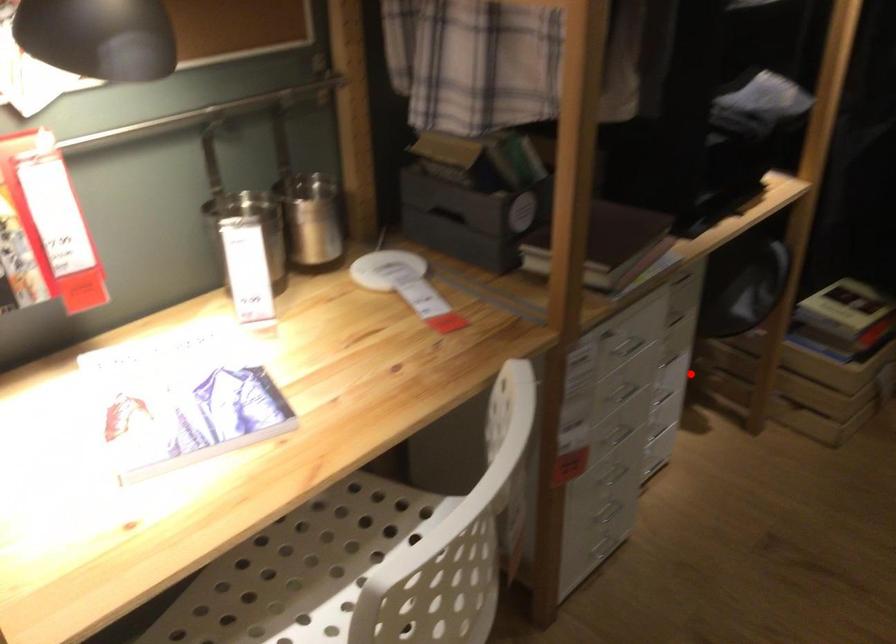
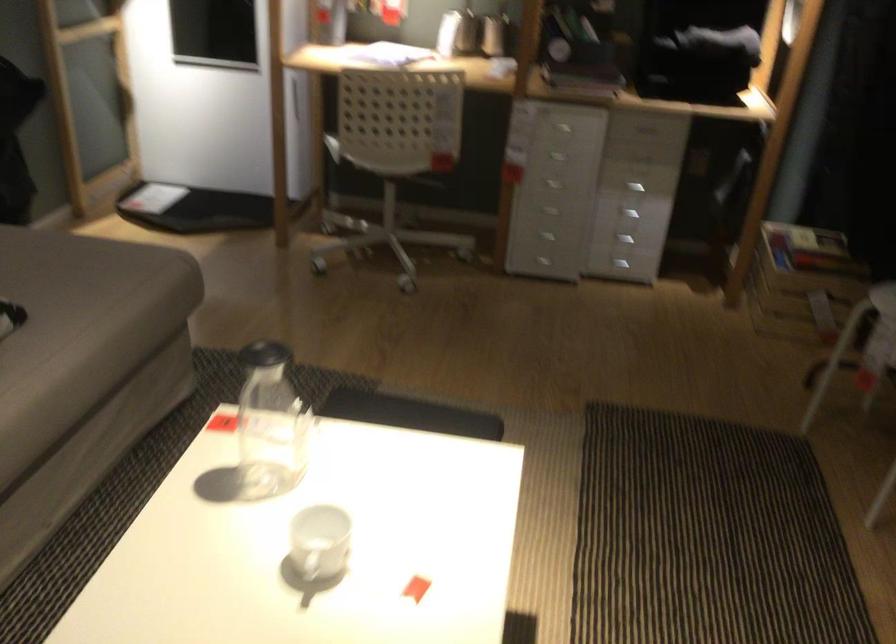
Where in the second image is the point corresponding to the highlighted location from the first image?

(634, 187)